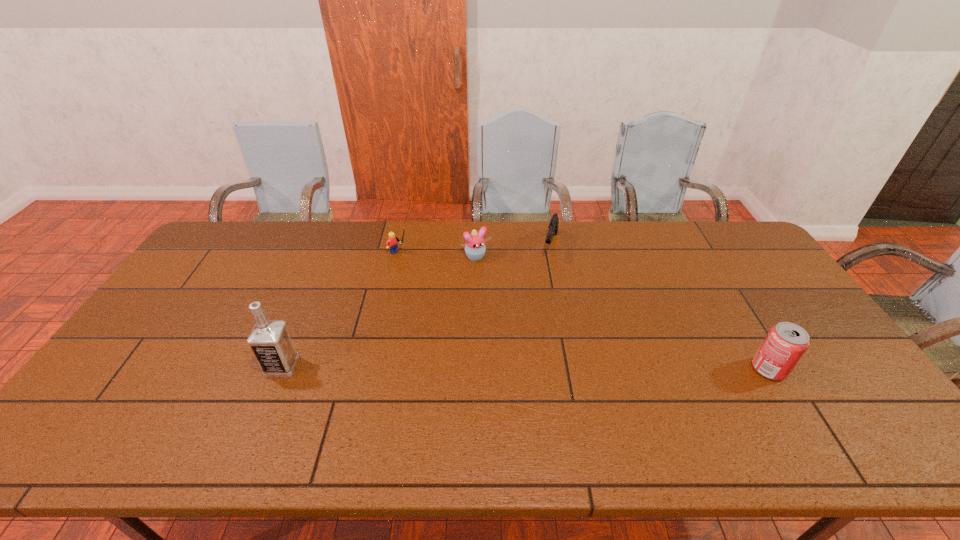
You are a GUI agent. You are given a task and a screenshot of the screen. Output one action in this format:
    pyautogui.click(x=<x>, y=<y>)
    Task: Click on the free space at the far right corner
    This screenshot has height=540, width=960.
    Given the screenshot: What is the action you would take?
    pyautogui.click(x=733, y=229)

Image resolution: width=960 pixels, height=540 pixels. In order to click on unoccupied area between the third object from left to right and the tallest object in this screenshot , I will do `click(379, 312)`.

This screenshot has width=960, height=540. I want to click on vacant point located between the fourth object from right to left and the vodka, so click(x=340, y=309).

Where is `free space between the gun and the rightmost object`? free space between the gun and the rightmost object is located at coordinates (660, 307).

At what (x,y) coordinates should I click in order to perform the action: click on vacant point located between the cupcake and the Lego. Please return your answer as a coordinate pair (x, y). Looking at the image, I should click on (438, 254).

Where is `free spot between the rightmost object and the Lego`? free spot between the rightmost object and the Lego is located at coordinates (584, 310).

Locate an element on the screen. This screenshot has height=540, width=960. free spot between the soda can and the Lego is located at coordinates (584, 310).

At what (x,y) coordinates should I click in order to perform the action: click on vacant space in between the cupcake and the fourth object from left to right. Please return your answer as a coordinate pair (x, y). This screenshot has height=540, width=960. Looking at the image, I should click on (514, 251).

At what (x,y) coordinates should I click in order to perform the action: click on vacant area that lies between the third object from left to right and the tallest object. Please return your answer as a coordinate pair (x, y). Looking at the image, I should click on (379, 312).

Image resolution: width=960 pixels, height=540 pixels. In order to click on object that can be found as the second closest to the fourth object from left to right in this screenshot , I will do `click(391, 243)`.